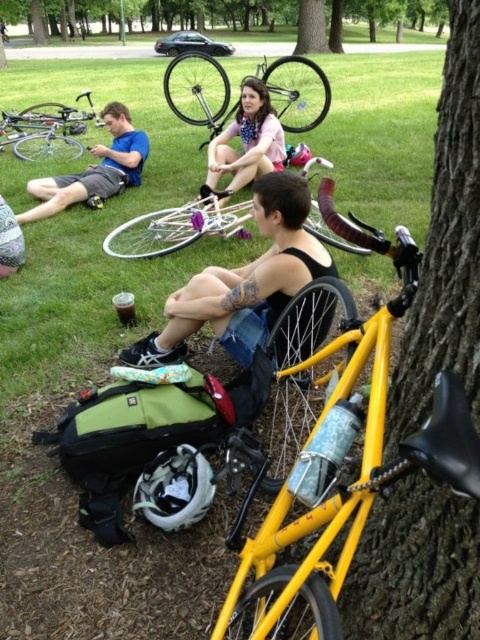
Question: Which point is closer to the camera taking this photo?

Choices:
 (A) (252, 129)
 (B) (446, 611)
 (C) (311, 28)
 (D) (124, 177)

Answer: (B)

Question: Can you confirm if silver metallic bicycle at upper center is smaller than silver metallic bicycle at center?

Choices:
 (A) yes
 (B) no

Answer: (B)

Question: Does yellow metallic bicycle at right have a lesser width compared to silver metallic bicycle at upper left?

Choices:
 (A) no
 (B) yes

Answer: (B)

Question: Does green textured tree at upper center have a lesser width compared to silver metallic bicycle at upper left?

Choices:
 (A) yes
 (B) no

Answer: (B)

Question: Which point appears farthest from the camera in this image?

Choices:
 (A) (303, 3)
 (B) (312, 20)
 (C) (175, 227)
 (D) (36, 145)

Answer: (A)

Question: Based on their relative distances, which object is nearer to the yellow metallic bicycle at right?

Choices:
 (A) silver metallic bicycle at upper left
 (B) black matte tank top at center
 (C) green grass at center
 (D) green textured tree at upper center

Answer: (B)